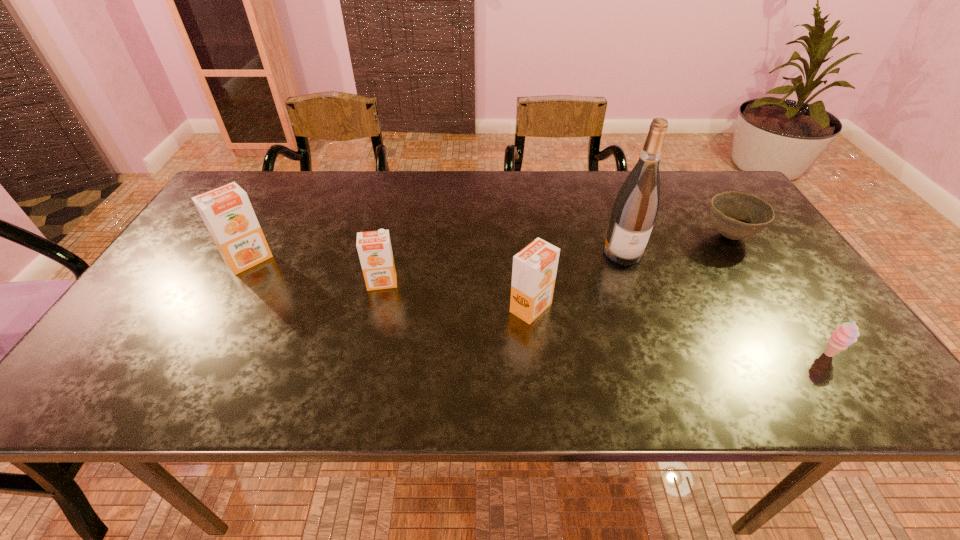
Locate an element on the screen. The image size is (960, 540). vacant spot to place a orange juice on the right is located at coordinates (698, 336).